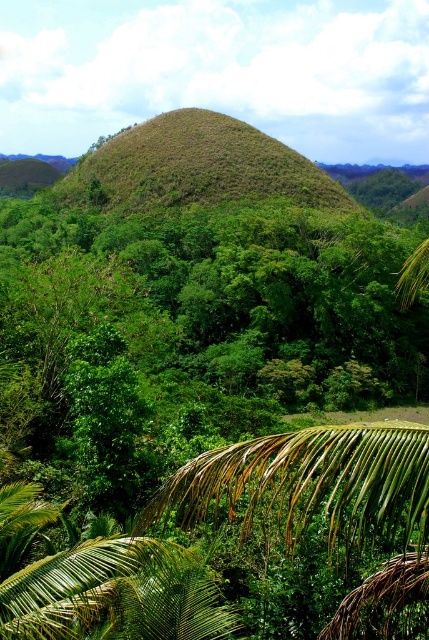
You are a hiker trying to navigate through the tropical landscape. You notice the green leafy palm at lower center and the brown grassy hill at center. Which object appears narrower when viewed from your current position?

The green leafy palm at lower center appears narrower because it has a lesser width compared to the brown grassy hill at center.

You are standing at the base of the Chocolate Hill in the tropical landscape. You notice a point marked at coordinates (313, 483). What object is located at this point?

The point at coordinates (313, 483) corresponds to the green leafy palm at lower center.

You are standing at the center of the Chocolate Hill and want to take a photo of the green leafy palm at lower center. According to the coordinates provided, in which direction should you move to get a clear view of the palm?

The green leafy palm at lower center is located at coordinates point (313,483), so you should move towards the lower center direction to get a clear view of the palm.